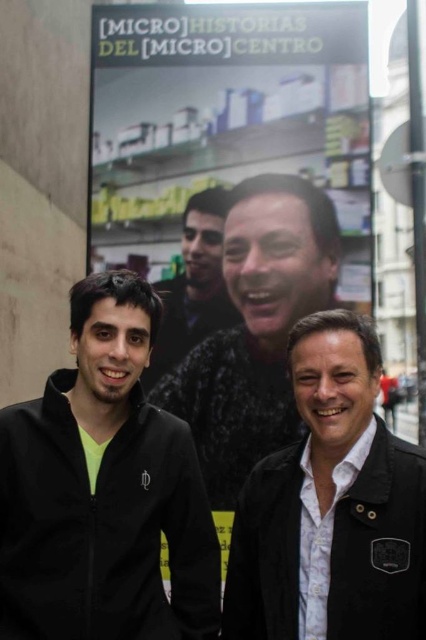
You are a photographer taking a picture of the billboard. You notice the black leather jacket at center and the matte plastic poster at upper center. Which object is closer to the camera?

The matte plastic poster at upper center is closer to the camera because the black leather jacket at center is behind it.